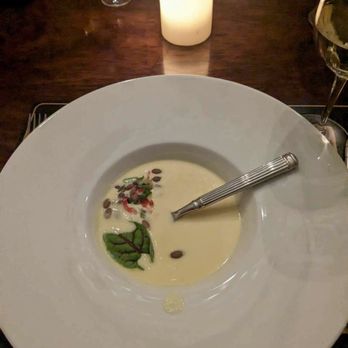
At what (x,y) coordinates should I click in order to perform the action: click on fork. Please return your answer as a coordinate pair (x, y). Looking at the image, I should click on (35, 120).